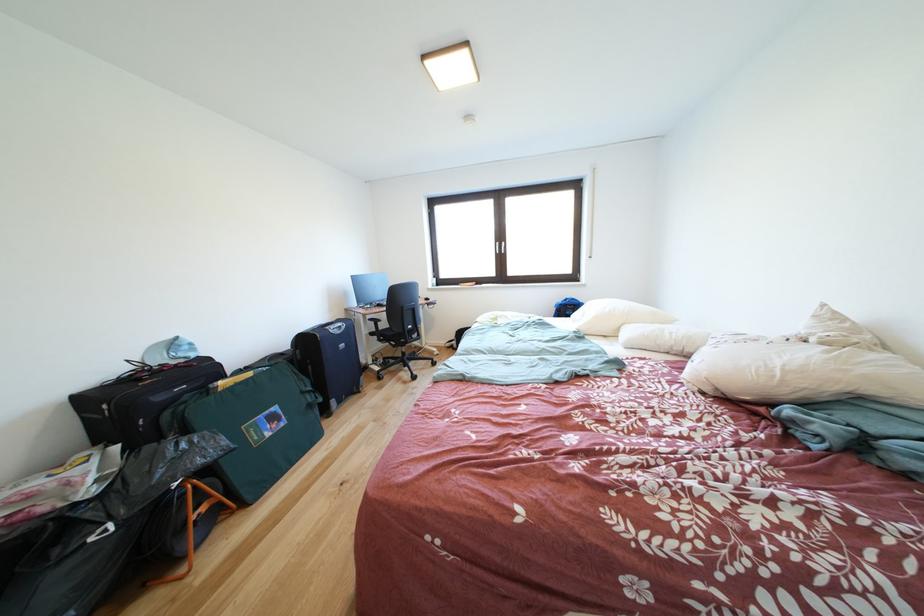
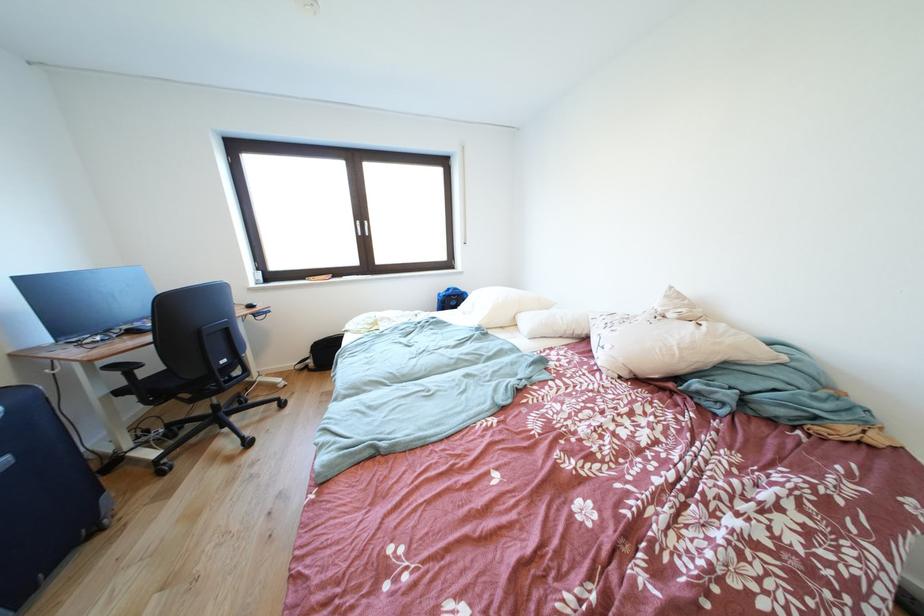
Where in the second image is the point corresponding to (380,323) from the first image?

(120, 371)